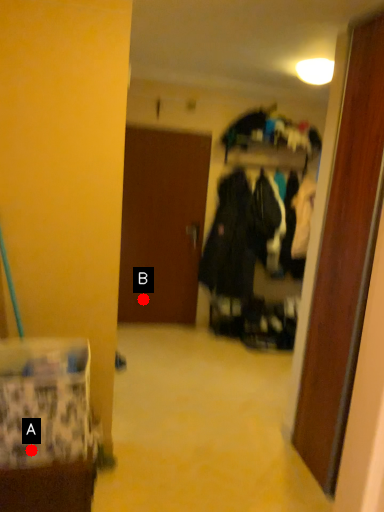
Question: Two points are circled on the image, labeled by A and B beside each circle. Among these points, which one is nearest to the camera?

Choices:
 (A) A is closer
 (B) B is closer

Answer: (A)